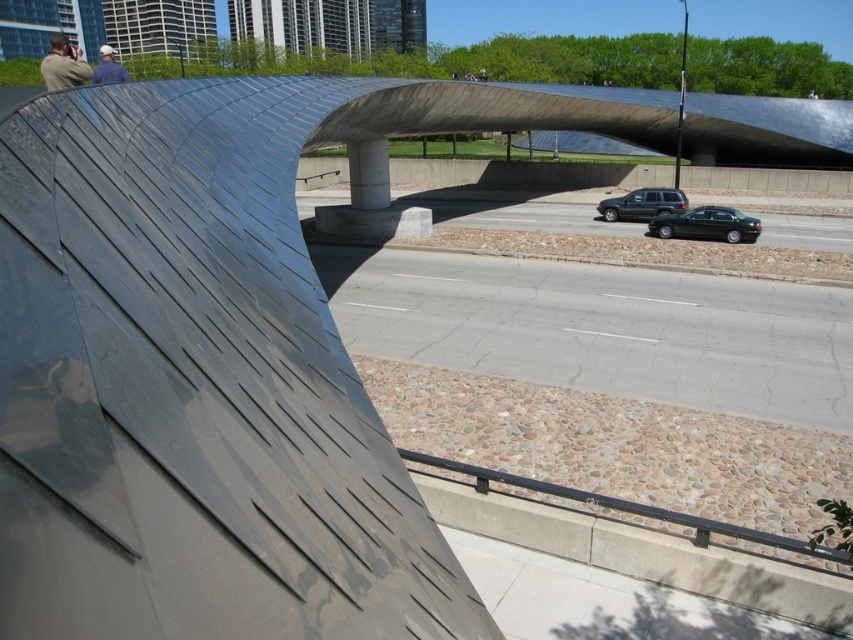
Question: Is dark green suv at center closer to the viewer compared to blue denim jacket at upper left?

Choices:
 (A) no
 (B) yes

Answer: (A)

Question: Is gray asphalt highway at center smaller than blue denim jacket at upper left?

Choices:
 (A) no
 (B) yes

Answer: (B)

Question: Which of these objects is positioned closest to the matte black jacket at upper left?

Choices:
 (A) dark green suv at center
 (B) shiny black sedan at center right
 (C) blue denim jacket at upper left
 (D) gray asphalt highway at center

Answer: (C)

Question: Which object is closer to the camera taking this photo?

Choices:
 (A) blue denim jacket at upper left
 (B) gray asphalt highway at center

Answer: (A)

Question: Which object is closer to the camera taking this photo?

Choices:
 (A) dark green suv at center
 (B) matte black jacket at upper left

Answer: (B)

Question: From the image, what is the correct spatial relationship of dark green suv at center in relation to blue denim jacket at upper left?

Choices:
 (A) above
 (B) below

Answer: (B)